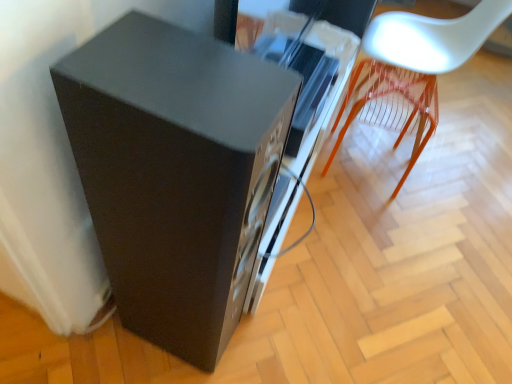
Describe the element at coordinates (413, 70) in the screenshot. The width and height of the screenshot is (512, 384). I see `white plastic chair at upper right` at that location.

The height and width of the screenshot is (384, 512). I want to click on white plastic chair at upper right, so click(413, 70).

Describe the element at coordinates (176, 173) in the screenshot. Image resolution: width=512 pixels, height=384 pixels. I see `matte black speaker at lower left` at that location.

Identify the location of matte black speaker at lower left. (176, 173).

Where is `white plastic chair at upper right`? This screenshot has width=512, height=384. white plastic chair at upper right is located at coordinates (413, 70).

Which is more to the right, white plastic chair at upper right or matte black speaker at lower left?

From the viewer's perspective, white plastic chair at upper right appears more on the right side.

In the image, is white plastic chair at upper right positioned in front of or behind matte black speaker at lower left?

white plastic chair at upper right is positioned farther from the viewer than matte black speaker at lower left.

Considering the positions of points (376, 60) and (163, 246), is point (376, 60) closer to camera compared to point (163, 246)?

That is False.

From the image's perspective, is white plastic chair at upper right beneath matte black speaker at lower left?

Incorrect, from the image's perspective, white plastic chair at upper right is higher than matte black speaker at lower left.

From a real-world perspective, which is physically above, white plastic chair at upper right or matte black speaker at lower left?

matte black speaker at lower left.

Which object is thinner, white plastic chair at upper right or matte black speaker at lower left?

matte black speaker at lower left.

Is white plastic chair at upper right shorter than matte black speaker at lower left?

Yes, white plastic chair at upper right is shorter than matte black speaker at lower left.

Between white plastic chair at upper right and matte black speaker at lower left, which one has larger size?

With larger size is white plastic chair at upper right.

Would you say matte black speaker at lower left is part of white plastic chair at upper right's contents?

Definitely not — matte black speaker at lower left is not inside white plastic chair at upper right.

Is white plastic chair at upper right placed right next to matte black speaker at lower left?

No, white plastic chair at upper right is not next to matte black speaker at lower left.

Is white plastic chair at upper right facing away from matte black speaker at lower left?

white plastic chair at upper right is not turned away from matte black speaker at lower left.

Locate an element on the screen. The width and height of the screenshot is (512, 384). furniture on the left of white plastic chair at upper right is located at coordinates (176, 173).

Is matte black speaker at lower left at the left side of white plastic chair at upper right?

Indeed, matte black speaker at lower left is positioned on the left side of white plastic chair at upper right.

Which object is further away from the camera, matte black speaker at lower left or white plastic chair at upper right?

white plastic chair at upper right.

Between point (248, 160) and point (429, 49), which one is positioned in front?

The point (248, 160) is closer to the camera.

From the image's perspective, between matte black speaker at lower left and white plastic chair at upper right, which one is located above?

white plastic chair at upper right is shown above in the image.

From a real-world perspective, is matte black speaker at lower left positioned above or below white plastic chair at upper right?

Clearly, from a real-world perspective, matte black speaker at lower left is above white plastic chair at upper right.

Is matte black speaker at lower left wider than white plastic chair at upper right?

In fact, matte black speaker at lower left might be narrower than white plastic chair at upper right.

Can you confirm if matte black speaker at lower left is taller than white plastic chair at upper right?

Yes.

Based on their sizes in the image, would you say matte black speaker at lower left is bigger or smaller than white plastic chair at upper right?

Considering their sizes, matte black speaker at lower left takes up less space than white plastic chair at upper right.

Would you say matte black speaker at lower left is outside white plastic chair at upper right?

matte black speaker at lower left is positioned outside white plastic chair at upper right.

Is the surface of matte black speaker at lower left in direct contact with white plastic chair at upper right?

matte black speaker at lower left and white plastic chair at upper right are not in contact.

Could you tell me if matte black speaker at lower left is facing white plastic chair at upper right?

No, matte black speaker at lower left is not oriented towards white plastic chair at upper right.

Identify the location of furniture that is in front of the white plastic chair at upper right. (176, 173).

The image size is (512, 384). Find the location of `furniture below the white plastic chair at upper right (from the image's perspective)`. furniture below the white plastic chair at upper right (from the image's perspective) is located at coordinates (176, 173).

The image size is (512, 384). In order to click on chair lying on the right of matte black speaker at lower left in this screenshot , I will do `click(413, 70)`.